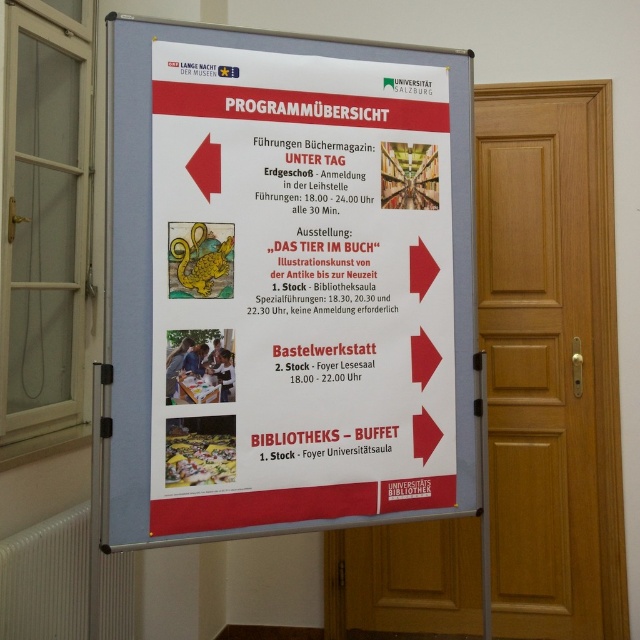
You are standing in a room with a whiteboard and a wooden door. You need to hang a new notice on the wall above the wooden door at right. Is the white paper poster at center currently blocking that spot?

The white paper poster at center is above the wooden door at right, so it is blocking the spot where you want to hang the new notice.

Imagine you are standing in front of the whiteboard at the University of Salzburg. You notice two points marked on the board. The first point is at coordinates point (291, 205) and the second is at point (538, 371). From your perspective, which point appears closer to you?

Point (291, 205) is in front of point (538, 371), so it appears closer to you.